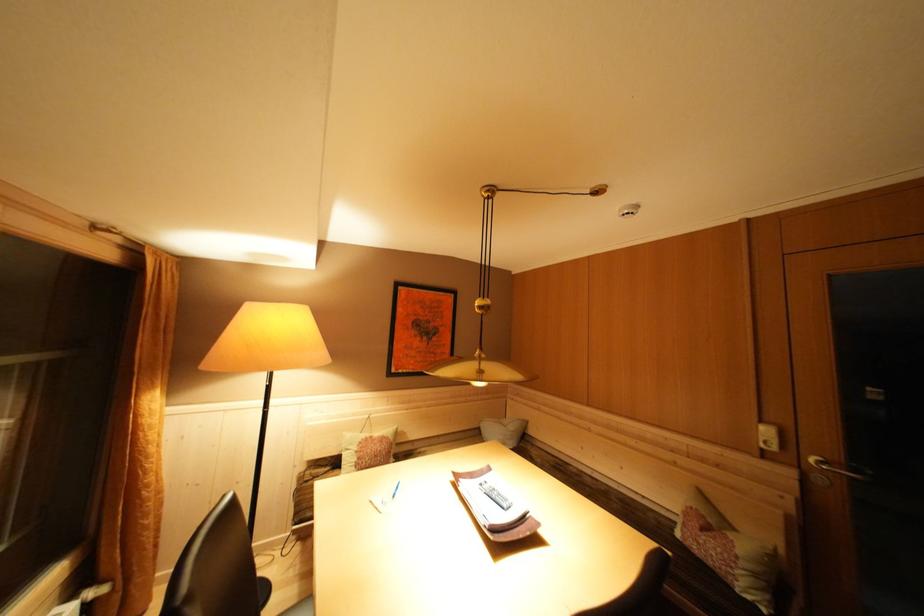
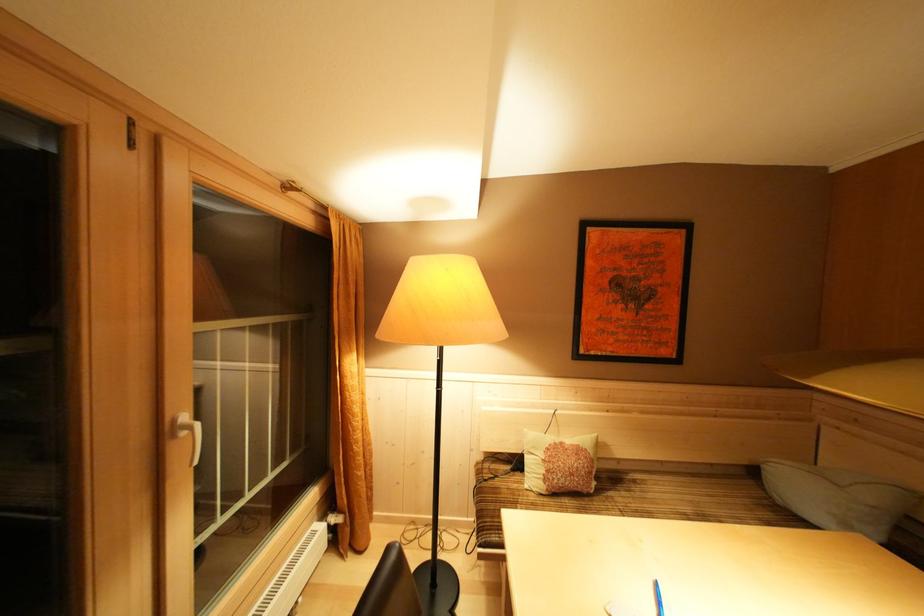
Where in the second image is the point corresponding to pixel 378 442 from the first image?

(568, 448)